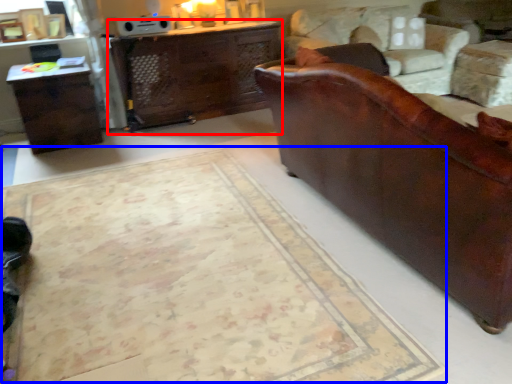
Question: Which of the following is the farthest to the observer, desk (highlighted by a red box) or mat (highlighted by a blue box)?

Choices:
 (A) desk
 (B) mat

Answer: (A)